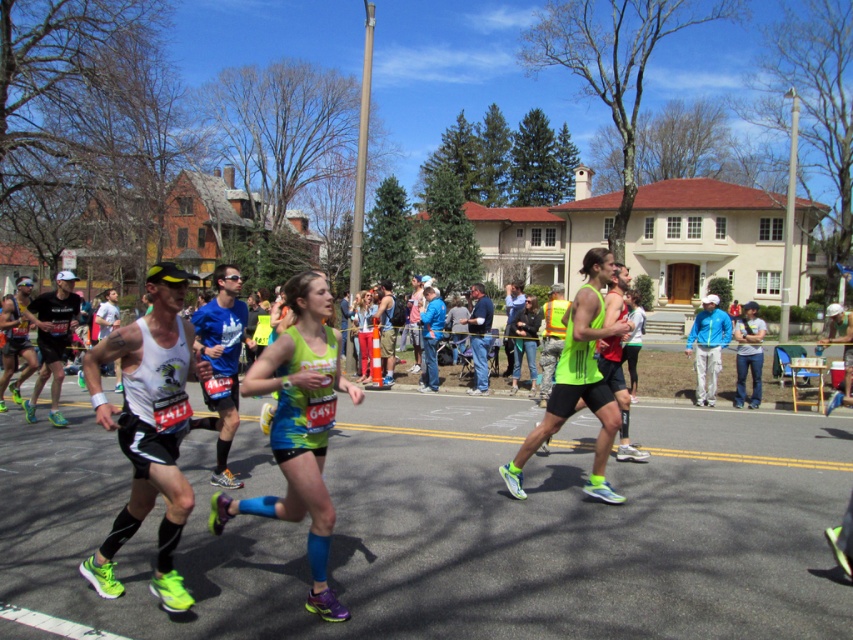
Does point (250, 499) come behind point (361, 337)?

No.

In the scene shown: Measure the distance between neon green fabric at center and camera.

neon green fabric at center and camera are 3.84 meters apart.

At what (x,y) coordinates should I click in order to perform the action: click on neon green fabric at center. Please return your answer as a coordinate pair (x, y). Image resolution: width=853 pixels, height=640 pixels. Looking at the image, I should click on (299, 428).